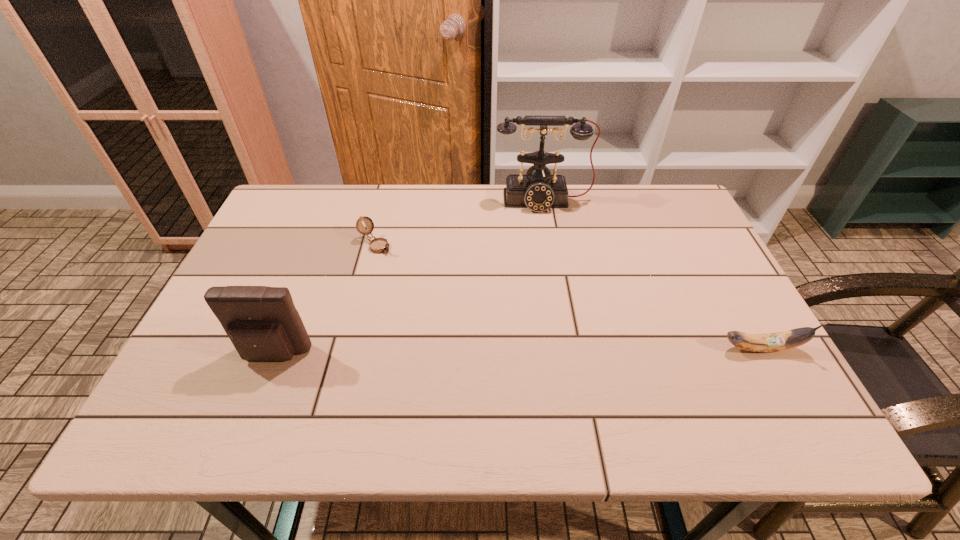
At what (x,y) coordinates should I click in order to perform the action: click on vacant area situated on the dial of the tallest object. Please return your answer as a coordinate pair (x, y). This screenshot has width=960, height=540. Looking at the image, I should click on (546, 224).

Image resolution: width=960 pixels, height=540 pixels. I want to click on vacant space positioned on the face of the second farthest object, so click(x=426, y=285).

Find the location of a particular element. The width and height of the screenshot is (960, 540). vacant space located on the face of the second farthest object is located at coordinates (444, 299).

Identify the location of free location located 0.260m on the face of the second farthest object. (449, 303).

In order to click on object located in the far edge section of the desktop in this screenshot , I will do `click(538, 190)`.

This screenshot has width=960, height=540. I want to click on object positioned at the near edge, so click(262, 322).

Identify the location of object present at the left edge. This screenshot has width=960, height=540. (262, 322).

Image resolution: width=960 pixels, height=540 pixels. I want to click on object located in the right edge section of the desktop, so click(785, 340).

You are a GUI agent. You are given a task and a screenshot of the screen. Output one action in this format:
    pyautogui.click(x=<x>, y=<y>)
    Task: Click on the object located in the near left corner section of the desktop
    This screenshot has height=540, width=960.
    Given the screenshot: What is the action you would take?
    pyautogui.click(x=262, y=322)

Find the location of a particular element. free point at the far edge is located at coordinates (x=613, y=191).